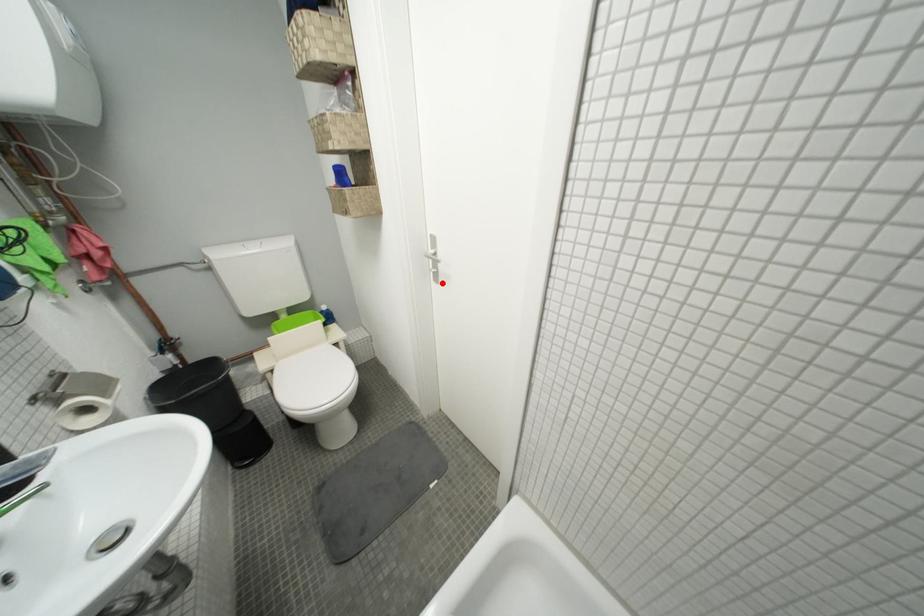
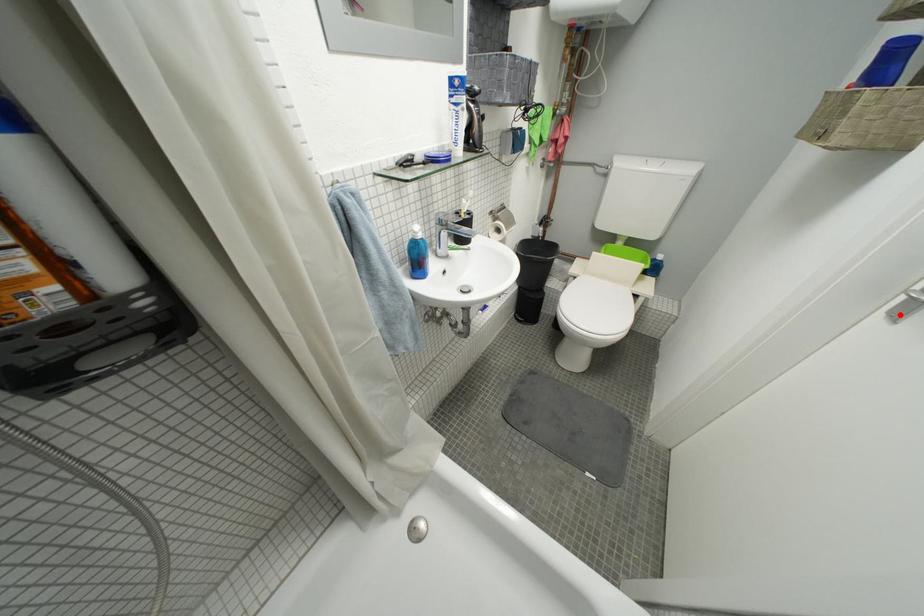
I am providing you with two images of the same scene from different viewpoints. A red point is marked on the first image and another point is marked on the second image. Do the highlighted points in image1 and image2 indicate the same real-world spot?

Yes